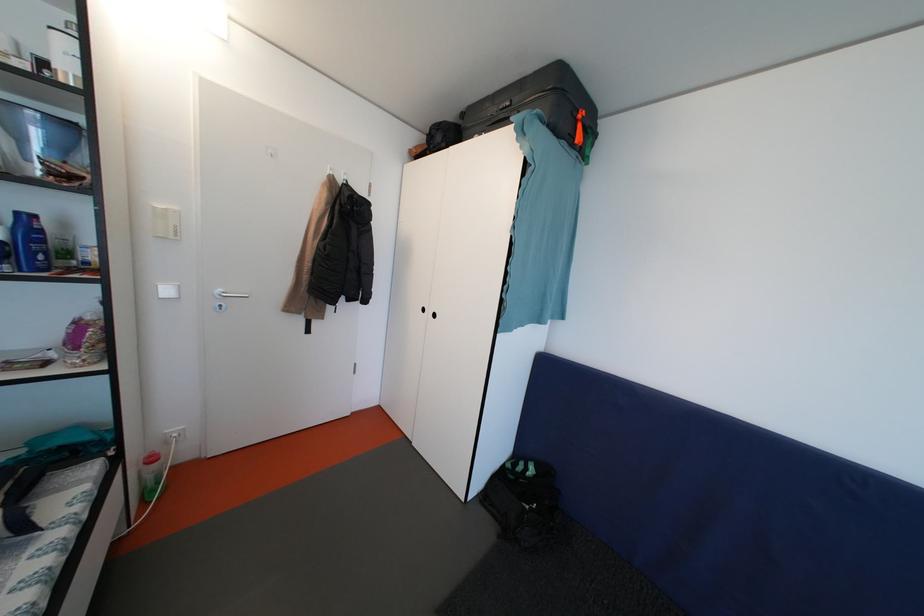
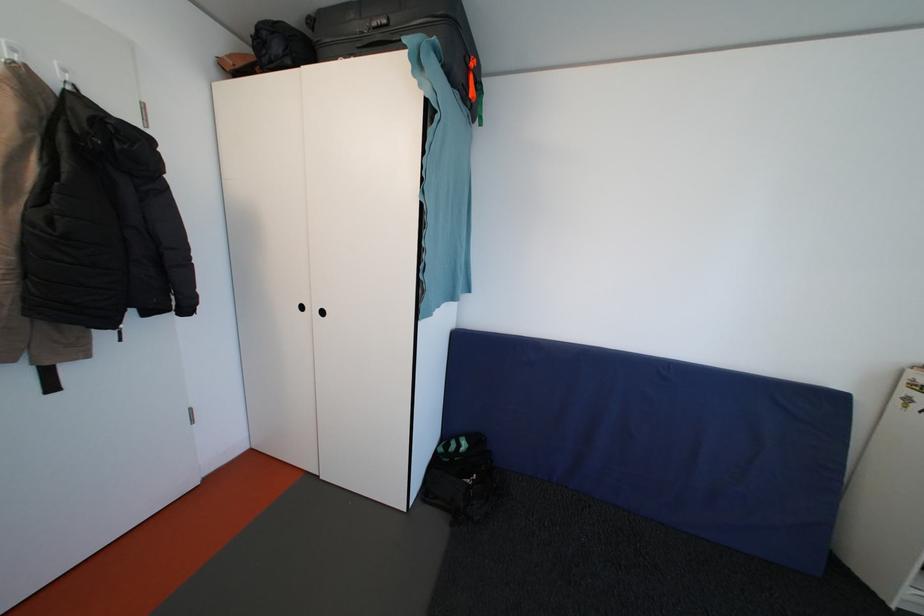
Locate, in the second image, the point that corresponds to (588,121) in the first image.

(479, 70)